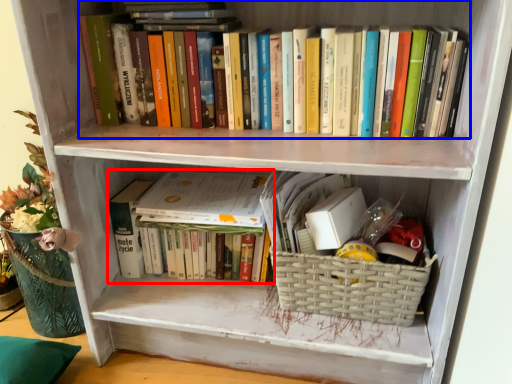
Question: Which object appears farthest to the camera in this image, book (highlighted by a red box) or book (highlighted by a blue box)?

Choices:
 (A) book
 (B) book

Answer: (A)